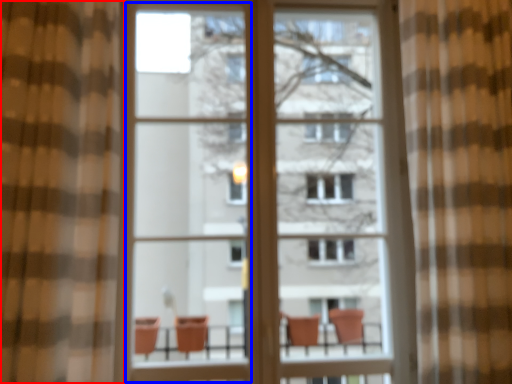
Question: Which object appears farthest to the camera in this image, curtain (highlighted by a red box) or screen door (highlighted by a blue box)?

Choices:
 (A) curtain
 (B) screen door

Answer: (B)